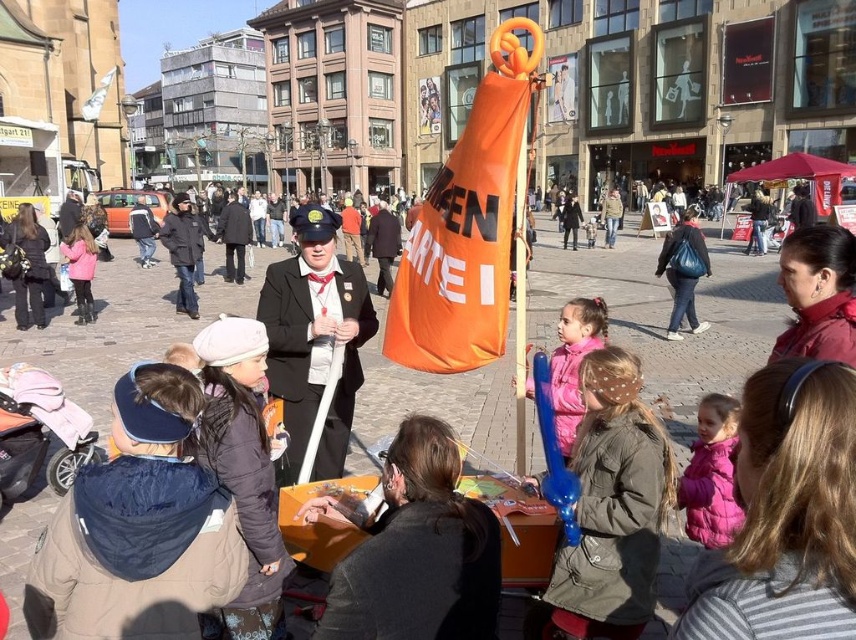
You are a visitor at this event and want to take a photo of the orange fabric banner at center while also capturing the dark gray puffer jacket at lower left in the frame. Which object should you position closer to the camera to ensure both are in focus?

To ensure both the orange fabric banner at center and the dark gray puffer jacket at lower left are in focus, position the dark gray puffer jacket at lower left closer to the camera since it is located below the orange fabric banner at center.

You are a photographer standing in the town square and want to take a photo of the matte blue balloon at center and the dark gray puffer jacket at lower left. Which object should you zoom in on to capture both in the frame without moving your camera?

You should zoom in on the dark gray puffer jacket at lower left because the matte blue balloon at center is shorter than it, allowing both to fit within the frame when focusing on the taller object.